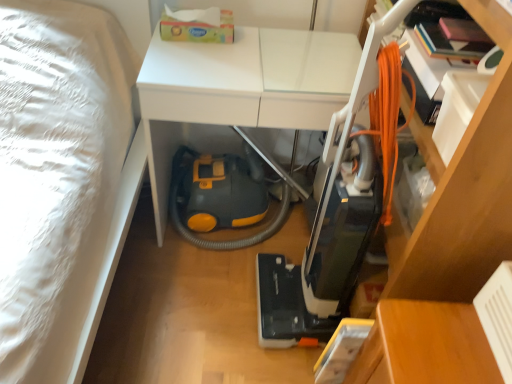
Question: Is orange corded vacuum cleaner at center at the left side of white glossy table at center, which is the 2th table from bottom to top?

Choices:
 (A) no
 (B) yes

Answer: (A)

Question: Considering the relative sizes of orange corded vacuum cleaner at center and white glossy table at center, positioned as the second table in right-to-left order, in the image provided, is orange corded vacuum cleaner at center bigger than white glossy table at center, positioned as the second table in right-to-left order,?

Choices:
 (A) yes
 (B) no

Answer: (B)

Question: Is orange corded vacuum cleaner at center taller than white glossy table at center, the 1th table positioned from the left?

Choices:
 (A) yes
 (B) no

Answer: (A)

Question: Is orange corded vacuum cleaner at center shorter than white glossy table at center, placed as the 1th table when sorted from top to bottom?

Choices:
 (A) yes
 (B) no

Answer: (B)

Question: Is orange corded vacuum cleaner at center positioned with its back to white glossy table at center, which is the 2th table from bottom to top?

Choices:
 (A) yes
 (B) no

Answer: (B)

Question: From the image's perspective, relative to orange corded vacuum cleaner at center, is wooden table at lower right, marked as the first table in a right-to-left arrangement, above or below?

Choices:
 (A) below
 (B) above

Answer: (A)

Question: Is wooden table at lower right, the second table viewed from the top, inside the boundaries of orange corded vacuum cleaner at center, or outside?

Choices:
 (A) outside
 (B) inside

Answer: (A)

Question: Is wooden table at lower right, marked as the first table in a right-to-left arrangement, in front of or behind orange corded vacuum cleaner at center in the image?

Choices:
 (A) front
 (B) behind

Answer: (B)

Question: Is wooden table at lower right, positioned as the 2th table in left-to-right order, taller or shorter than orange corded vacuum cleaner at center?

Choices:
 (A) short
 (B) tall

Answer: (A)

Question: From their relative heights in the image, would you say white glossy table at center, which is the 2th table from bottom to top, is taller or shorter than orange corded vacuum cleaner at center?

Choices:
 (A) short
 (B) tall

Answer: (A)

Question: Is white glossy table at center, placed as the 1th table when sorted from top to bottom, wider or thinner than orange corded vacuum cleaner at center?

Choices:
 (A) wide
 (B) thin

Answer: (A)

Question: Considering their positions, is white glossy table at center, placed as the 1th table when sorted from top to bottom, located in front of or behind orange corded vacuum cleaner at center?

Choices:
 (A) behind
 (B) front

Answer: (A)

Question: Is point pyautogui.click(x=152, y=125) positioned closer to the camera than point pyautogui.click(x=389, y=23)?

Choices:
 (A) closer
 (B) farther

Answer: (B)

Question: From a real-world perspective, relative to white glossy table at center, the 1th table positioned from the left, is wooden table at lower right, marked as the first table in a right-to-left arrangement, vertically above or below?

Choices:
 (A) above
 (B) below

Answer: (B)

Question: Looking at the image, does wooden table at lower right, positioned as the 2th table in left-to-right order, seem bigger or smaller compared to white glossy table at center, the 1th table positioned from the left?

Choices:
 (A) big
 (B) small

Answer: (B)